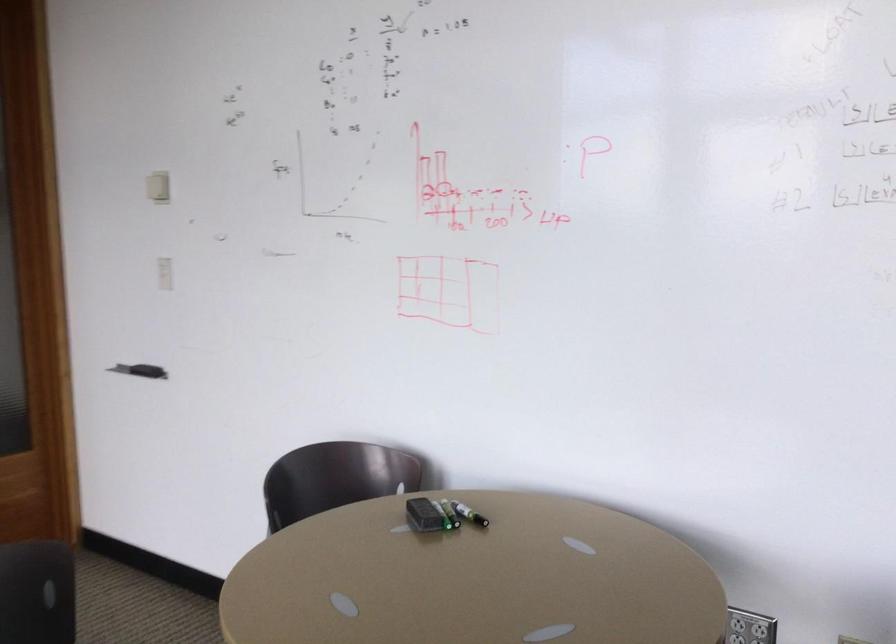
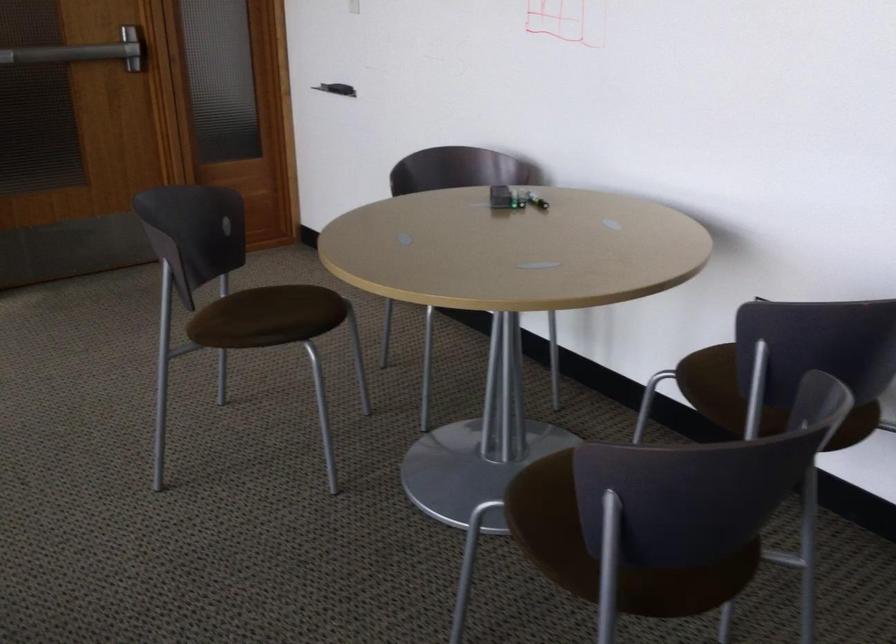
The point at [440,514] is marked in the first image. Where is the corresponding point in the second image?

(515, 196)